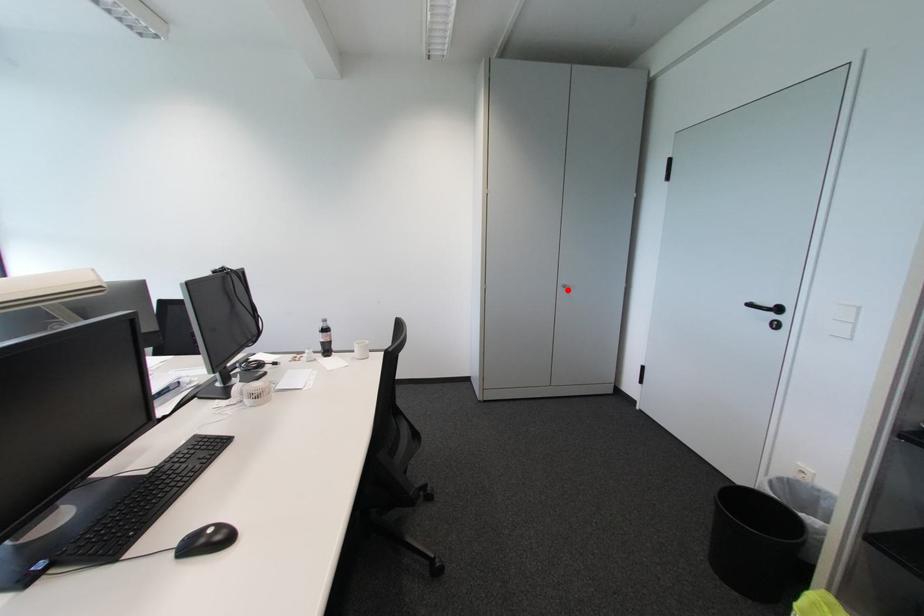
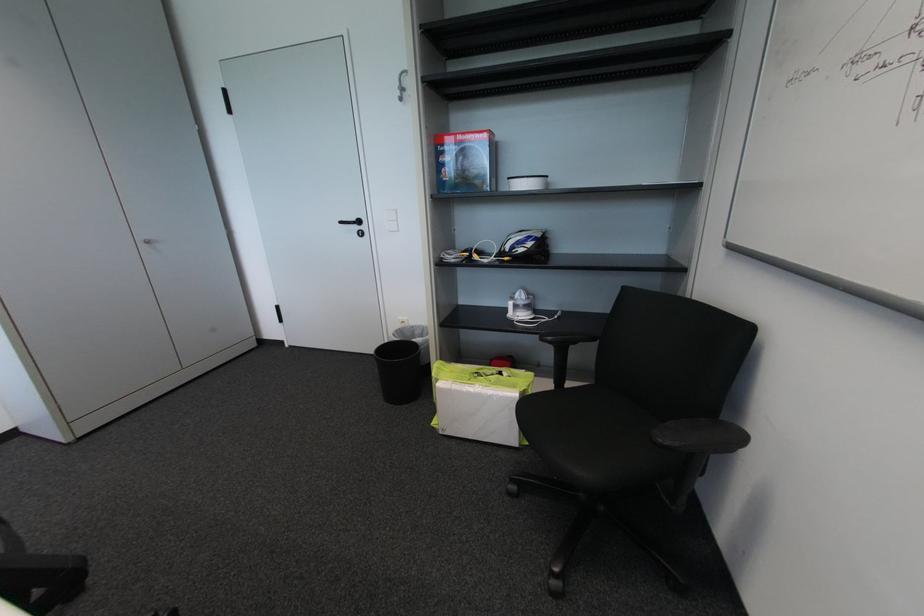
Locate, in the second image, the point that corresponds to the highlighted location in the first image.

(151, 246)